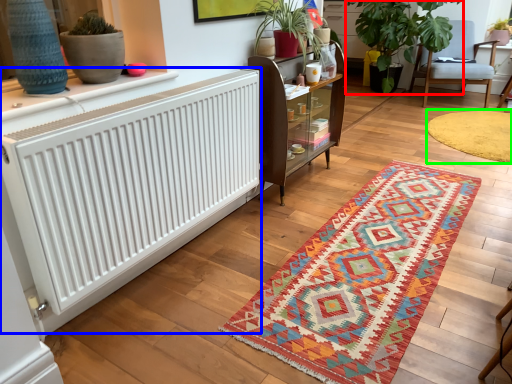
Question: Estimate the real-world distances between objects in this image. Which object is farther from houseplant (highlighted by a red box), radiator (highlighted by a blue box) or mat (highlighted by a green box)?

Choices:
 (A) radiator
 (B) mat

Answer: (A)